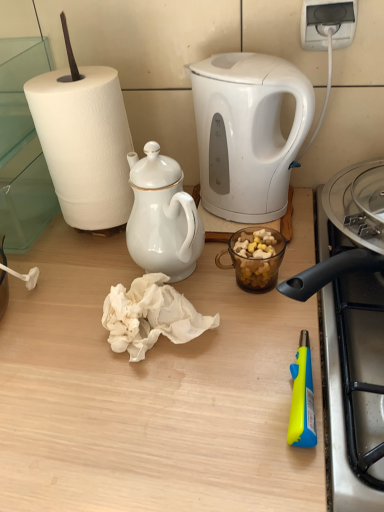
Where is `vacant area that lies in front of white porcelain teapot at upper center`? Image resolution: width=384 pixels, height=512 pixels. vacant area that lies in front of white porcelain teapot at upper center is located at coordinates (157, 394).